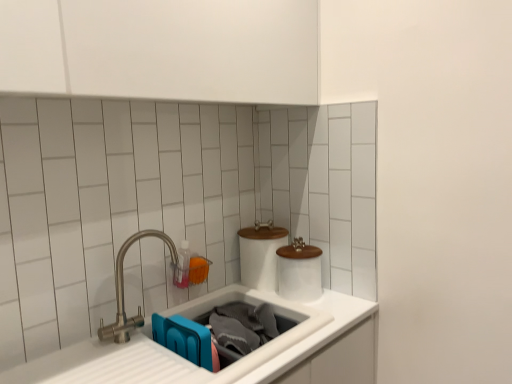
Question: Is white ceramic toilet paper at center, which is the first toilet paper in left-to-right order, to the left or to the right of white matte sink at lower center, the second sink positioned from the left, in the image?

Choices:
 (A) right
 (B) left

Answer: (A)

Question: In terms of width, does white ceramic toilet paper at center, which is the first toilet paper in left-to-right order, look wider or thinner when compared to white matte sink at lower center, marked as the first sink in a right-to-left arrangement?

Choices:
 (A) thin
 (B) wide

Answer: (A)

Question: Estimate the real-world distances between objects in this image. Which object is closer to the white ceramic toilet paper at center, which is the first toilet paper in left-to-right order?

Choices:
 (A) white matte sink at lower center, marked as the first sink in a right-to-left arrangement
 (B) white glossy toilet paper at center, which is the 2th toilet paper in left-to-right order
 (C) white glossy sink at lower left, placed as the 2th sink when sorted from right to left
 (D) translucent plastic bottle at sink
 (E) brushed metal faucet at left

Answer: (B)

Question: Which is nearer to the brushed metal faucet at left?

Choices:
 (A) white ceramic toilet paper at center, which is the first toilet paper in left-to-right order
 (B) white glossy sink at lower left, placed as the 2th sink when sorted from right to left
 (C) white matte sink at lower center, marked as the first sink in a right-to-left arrangement
 (D) white glossy toilet paper at center, placed as the first toilet paper when sorted from right to left
 (E) translucent plastic bottle at sink

Answer: (E)